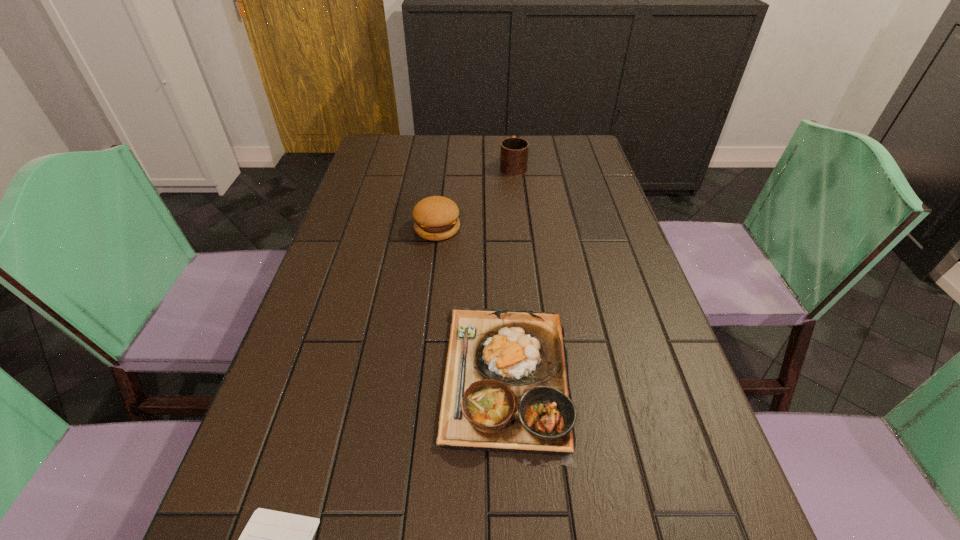
The height and width of the screenshot is (540, 960). In order to click on free space between the mug and the third nearest object in this screenshot , I will do click(x=475, y=197).

Locate which object is the third closest to the second shortest object. Please provide its 2D coordinates. Your answer should be formatted as a tuple, i.e. [(x, y)], where the tuple contains the x and y coordinates of a point satisfying the conditions above.

[(514, 151)]

This screenshot has height=540, width=960. I want to click on object that is the third closest to the third tallest object, so click(x=514, y=151).